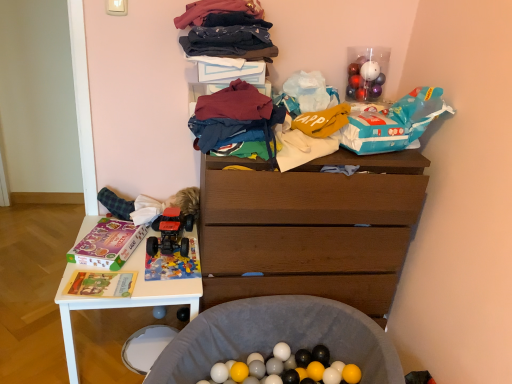
The width and height of the screenshot is (512, 384). I want to click on vacant area that lies in front of fluffy green fabric at left, so click(x=153, y=267).